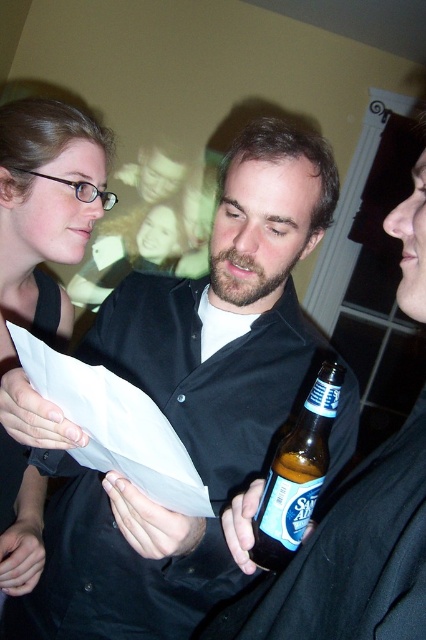
Question: Which of the following is the farthest from the observer?

Choices:
 (A) (57, 145)
 (B) (324, 461)

Answer: (A)

Question: Does white paper at center lie behind brown glass bottle at center?

Choices:
 (A) yes
 (B) no

Answer: (B)

Question: Can you confirm if matte black hair at upper left is wider than brown glass bottle at center?

Choices:
 (A) no
 (B) yes

Answer: (B)

Question: Which object is positioned closest to the white paper at center?

Choices:
 (A) brown glass bottle at center
 (B) matte black hair at upper left

Answer: (A)

Question: Which point is closer to the camera?

Choices:
 (A) (146, 502)
 (B) (2, 346)
 (C) (92, 429)

Answer: (C)

Question: From the image, what is the correct spatial relationship of matte black shirt at center in relation to brown glass bottle at center?

Choices:
 (A) left
 (B) right

Answer: (A)